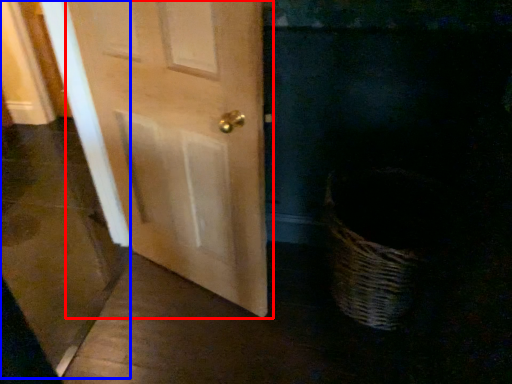
Question: Which object is closer to the camera taking this photo, door (highlighted by a red box) or screen door (highlighted by a blue box)?

Choices:
 (A) door
 (B) screen door

Answer: (B)